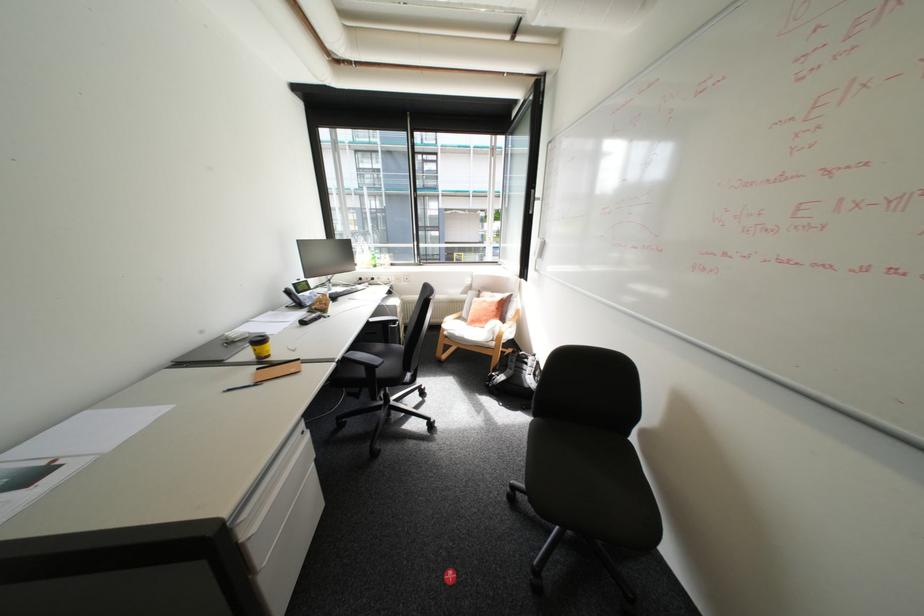
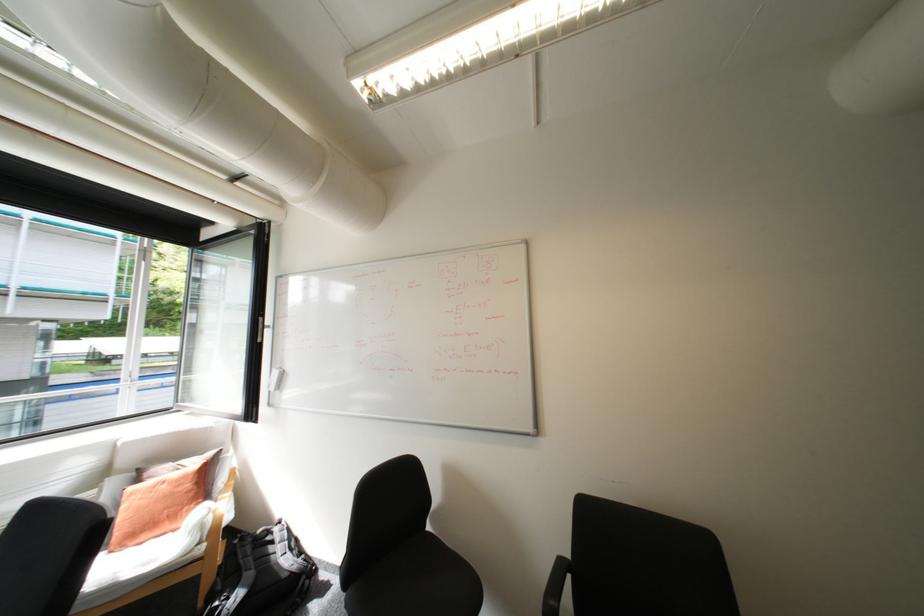
Locate, in the second image, the point that corresponds to point 494,302 in the first image.

(175, 485)